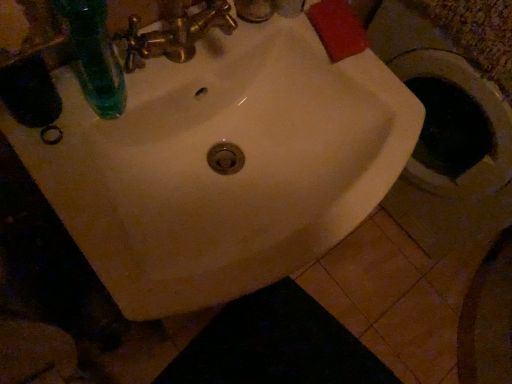
Describe the element at coordinates (210, 19) in the screenshot. I see `gold metallic faucet at upper center` at that location.

Locate an element on the screen. gold metallic faucet at upper center is located at coordinates (210, 19).

Is black fabric at lower center a part of green glass bottle at upper left?

No, green glass bottle at upper left does not contain black fabric at lower center.

Is green glass bottle at upper left not near black fabric at lower center?

They are positioned close to each other.

Relative to black fabric at lower center, is green glass bottle at upper left in front or behind?

Clearly, green glass bottle at upper left is in front of black fabric at lower center.

Does green glass bottle at upper left have a greater width compared to black fabric at lower center?

No, green glass bottle at upper left is not wider than black fabric at lower center.

Is green glass bottle at upper left far away from gold metallic faucet at upper center?

No, green glass bottle at upper left is not far away from gold metallic faucet at upper center.

Who is shorter, green glass bottle at upper left or gold metallic faucet at upper center?

gold metallic faucet at upper center is shorter.

Locate an element on the screen. Image resolution: width=512 pixels, height=384 pixels. bottle above the gold metallic faucet at upper center (from a real-world perspective) is located at coordinates (95, 56).

From a real-world perspective, is gold metallic faucet at upper center located higher than black fabric at lower center?

Indeed, from a real-world perspective, gold metallic faucet at upper center stands above black fabric at lower center.

Looking at this image, does gold metallic faucet at upper center have a smaller size compared to black fabric at lower center?

Indeed, gold metallic faucet at upper center has a smaller size compared to black fabric at lower center.

Locate an element on the screen. The height and width of the screenshot is (384, 512). plumbing fixture in front of the black fabric at lower center is located at coordinates (210, 19).

Considering the relative sizes of white glossy sink at center and green glass bottle at upper left in the image provided, is white glossy sink at center bigger than green glass bottle at upper left?

Correct, white glossy sink at center is larger in size than green glass bottle at upper left.

Which object is further away from the camera, white glossy sink at center or green glass bottle at upper left?

white glossy sink at center is more distant.

From the image's perspective, is white glossy sink at center located above or below green glass bottle at upper left?

white glossy sink at center is below green glass bottle at upper left.

Would you say black fabric at lower center is to the left or to the right of gold metallic faucet at upper center in the picture?

black fabric at lower center is to the right of gold metallic faucet at upper center.

From a real-world perspective, which is physically below, black fabric at lower center or gold metallic faucet at upper center?

black fabric at lower center.

From the image's perspective, between black fabric at lower center and gold metallic faucet at upper center, which one is located above?

gold metallic faucet at upper center, from the image's perspective.

Could you tell me if black fabric at lower center is facing gold metallic faucet at upper center?

No, black fabric at lower center is not oriented towards gold metallic faucet at upper center.

Is black fabric at lower center positioned with its back to white glossy sink at center?

No, white glossy sink at center is not at the back of black fabric at lower center.

From the picture: Measure the distance from black fabric at lower center to white glossy sink at center.

A distance of 31.57 inches exists between black fabric at lower center and white glossy sink at center.

Does black fabric at lower center have a greater width compared to white glossy sink at center?

Yes.

Which is closer, (322, 349) or (123, 163)?

The point (123, 163) is closer.

Which point is more distant from viewer, (108,98) or (8,121)?

Point (108,98)

Is green glass bottle at upper left facing towards white glossy sink at center?

No.

In the scene shown: Measure the distance between green glass bottle at upper left and white glossy sink at center.

green glass bottle at upper left is 7.65 inches from white glossy sink at center.

Is green glass bottle at upper left far away from white glossy sink at center?

green glass bottle at upper left is near white glossy sink at center, not far away.

Where is `dark that is below the green glass bottle at upper left (from the image's perspective)`? The image size is (512, 384). dark that is below the green glass bottle at upper left (from the image's perspective) is located at coordinates (276, 345).

Find the location of a particular element. This screenshot has width=512, height=384. plumbing fixture above the green glass bottle at upper left (from the image's perspective) is located at coordinates (210, 19).

From the image, which object appears to be farther from green glass bottle at upper left, gold metallic faucet at upper center or white glossy sink at center?

white glossy sink at center lies further to green glass bottle at upper left than the other object.

Considering their positions, is gold metallic faucet at upper center positioned closer to white glossy sink at center than green glass bottle at upper left?

Among the two, green glass bottle at upper left is located nearer to white glossy sink at center.

Looking at the image, which one is located closer to black fabric at lower center, white glossy sink at center or gold metallic faucet at upper center?

Based on the image, white glossy sink at center appears to be nearer to black fabric at lower center.

From the image, which object appears to be farther from gold metallic faucet at upper center, black fabric at lower center or green glass bottle at upper left?

black fabric at lower center is further to gold metallic faucet at upper center.

Looking at the image, which one is located further to gold metallic faucet at upper center, green glass bottle at upper left or black fabric at lower center?

The object further to gold metallic faucet at upper center is black fabric at lower center.

Considering their positions, is black fabric at lower center positioned further to green glass bottle at upper left than white glossy sink at center?

Based on the image, black fabric at lower center appears to be further to green glass bottle at upper left.

Estimate the real-world distances between objects in this image. Which object is further from green glass bottle at upper left, white glossy sink at center or black fabric at lower center?

black fabric at lower center.

Estimate the real-world distances between objects in this image. Which object is further from white glossy sink at center, green glass bottle at upper left or black fabric at lower center?

The object further to white glossy sink at center is black fabric at lower center.

Where is `sink between green glass bottle at upper left and gold metallic faucet at upper center from front to back`? This screenshot has height=384, width=512. sink between green glass bottle at upper left and gold metallic faucet at upper center from front to back is located at coordinates (225, 159).

Find the location of a particular element. sink between green glass bottle at upper left and black fabric at lower center from front to back is located at coordinates (225, 159).

Locate an element on the screen. bottle between gold metallic faucet at upper center and black fabric at lower center vertically is located at coordinates (95, 56).

At what (x,y) coordinates should I click in order to perform the action: click on sink between gold metallic faucet at upper center and black fabric at lower center in the up-down direction. Please return your answer as a coordinate pair (x, y). Looking at the image, I should click on (225, 159).